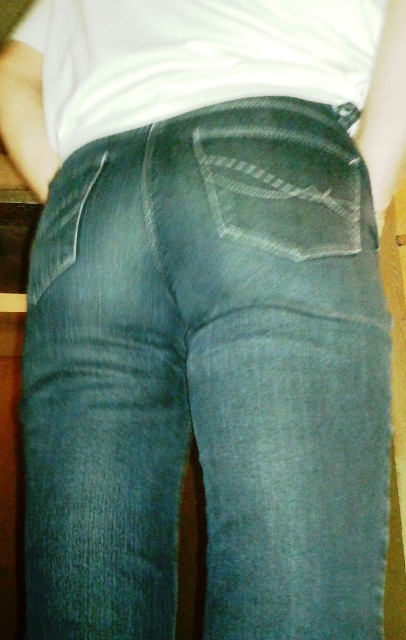
Question: Is white matte shirt at upper center thinner than denim pocket at center?

Choices:
 (A) no
 (B) yes

Answer: (A)

Question: Which point appears closest to the camera in this image?

Choices:
 (A) (157, 28)
 (B) (289, 198)

Answer: (B)

Question: Is white matte shirt at upper center smaller than denim pocket at center?

Choices:
 (A) yes
 (B) no

Answer: (B)

Question: In this image, where is white matte shirt at upper center located relative to denim pocket at center?

Choices:
 (A) above
 (B) below

Answer: (A)